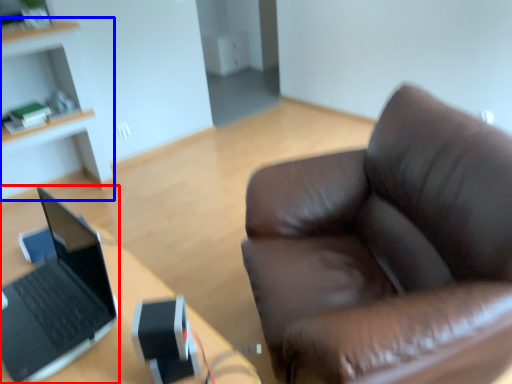
Question: Which object is closer to the camera taking this photo, laptop (highlighted by a red box) or cabinetry (highlighted by a blue box)?

Choices:
 (A) laptop
 (B) cabinetry

Answer: (A)